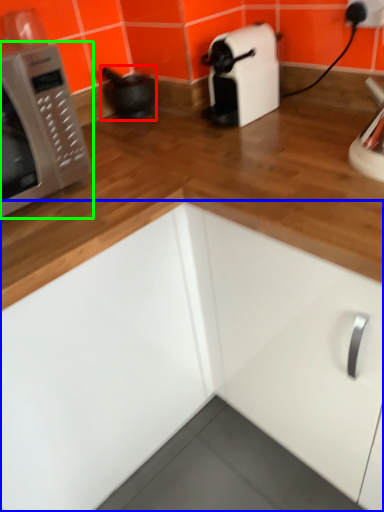
Question: Estimate the real-world distances between objects in this image. Which object is farther from appliance (highlighted by a red box), cabinetry (highlighted by a blue box) or microwave oven (highlighted by a green box)?

Choices:
 (A) cabinetry
 (B) microwave oven

Answer: (A)